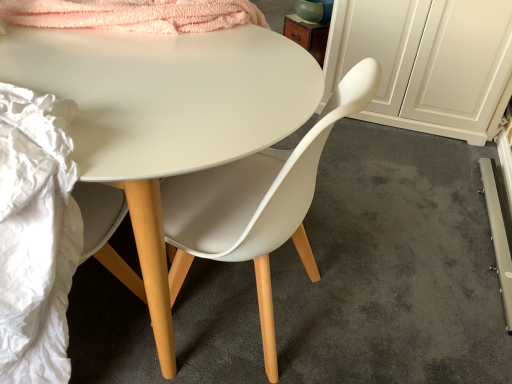
Find the location of a particular element. Image resolution: width=512 pixels, height=384 pixels. vacant space in between white matte cabinet at right and matte white chair at center is located at coordinates (389, 202).